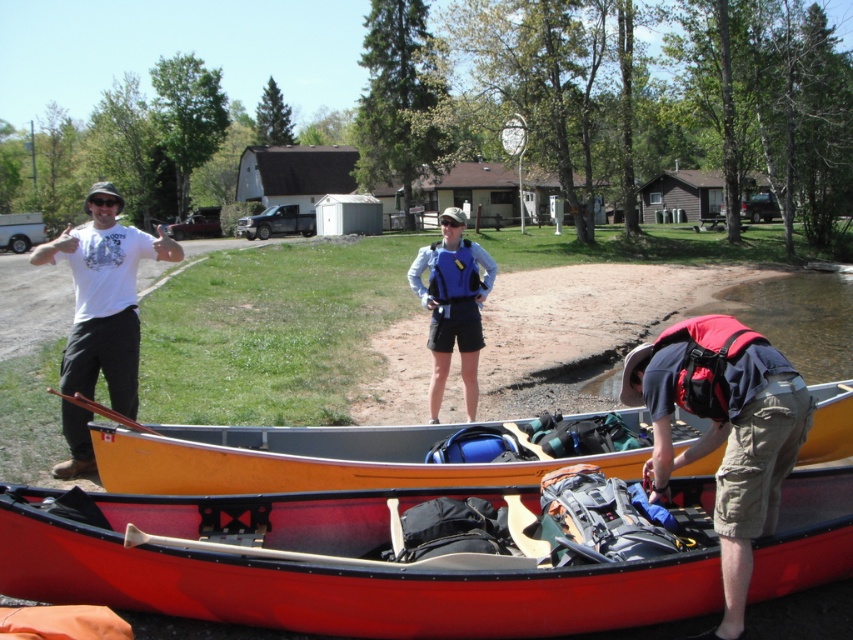
Question: Among these objects, which one is farthest from the camera?

Choices:
 (A) khaki cargo shorts at lower right
 (B) red plastic canoe at lower center
 (C) wooden canoe at center

Answer: (C)

Question: Can you confirm if khaki cargo shorts at lower right is positioned to the left of blue fabric life vest at center?

Choices:
 (A) no
 (B) yes

Answer: (A)

Question: Which point is closer to the camera taking this photo?

Choices:
 (A) (534, 600)
 (B) (467, 300)
 (C) (778, 385)
 (D) (71, 358)

Answer: (C)

Question: Can you confirm if khaki cargo shorts at lower right is positioned below blue fabric life vest at center?

Choices:
 (A) yes
 (B) no

Answer: (A)

Question: Is red plastic canoe at lower center bigger than blue fabric life vest at center?

Choices:
 (A) yes
 (B) no

Answer: (A)

Question: Which of these objects is positioned closest to the khaki cargo shorts at lower right?

Choices:
 (A) blue fabric life vest at center
 (B) white t-shirt at left
 (C) wooden canoe at center
 (D) red plastic canoe at lower center

Answer: (D)